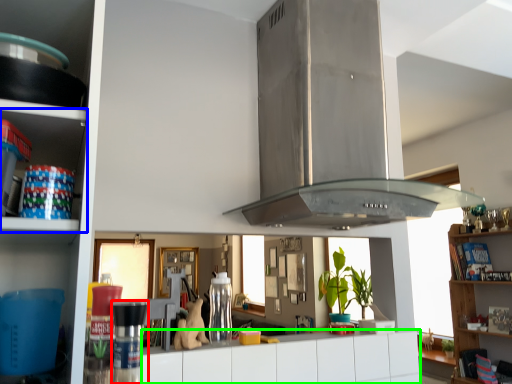
Question: Which object is the farthest from appliance (highlighted by a red box)? Choose among these: shelf (highlighted by a blue box) or drawer (highlighted by a green box).

Choices:
 (A) shelf
 (B) drawer

Answer: (B)